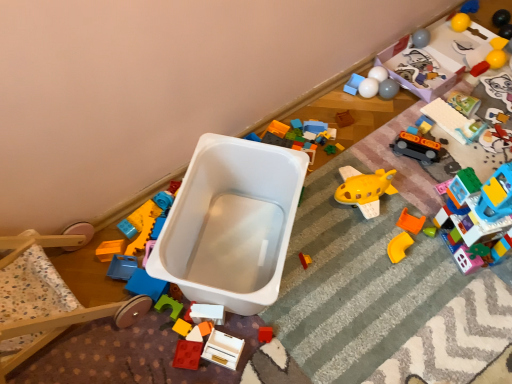
This screenshot has height=384, width=512. What are the coordinates of `free space between matte gray cat at upper right, which is the fifteenth toy in left-to-right order, and orange plastic block at lower right, placed as the 10th toy when sorted from left to right` in the screenshot? It's located at (466, 145).